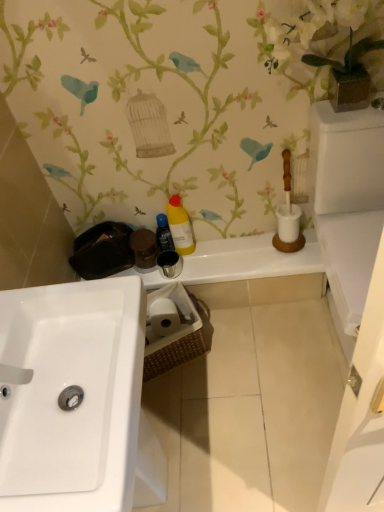
Question: Is yellow matte bottle at center, the second cleaning product positioned from the right, facing towards white glossy sink at lower left?

Choices:
 (A) no
 (B) yes

Answer: (B)

Question: Is yellow matte bottle at center, the second cleaning product positioned from the right, closer to the viewer compared to white glossy sink at lower left?

Choices:
 (A) yes
 (B) no

Answer: (B)

Question: From the image's perspective, is yellow matte bottle at center, the second cleaning product positioned from the right, below white glossy sink at lower left?

Choices:
 (A) no
 (B) yes

Answer: (A)

Question: Is yellow matte bottle at center, the second cleaning product positioned from the right, turned away from white glossy sink at lower left?

Choices:
 (A) yes
 (B) no

Answer: (B)

Question: Is yellow matte bottle at center, arranged as the 1th cleaning product when viewed from the left, taller than white glossy sink at lower left?

Choices:
 (A) yes
 (B) no

Answer: (B)

Question: From the image's perspective, is yellow matte bottle at center, the second cleaning product positioned from the right, over white glossy sink at lower left?

Choices:
 (A) yes
 (B) no

Answer: (A)

Question: Can you confirm if white glossy sink at lower left is thinner than matte black toiletries at center?

Choices:
 (A) no
 (B) yes

Answer: (A)

Question: Can you confirm if white glossy sink at lower left is taller than matte black toiletries at center?

Choices:
 (A) yes
 (B) no

Answer: (A)

Question: Is white glossy sink at lower left facing towards matte black toiletries at center?

Choices:
 (A) no
 (B) yes

Answer: (A)

Question: From a real-world perspective, does white glossy sink at lower left sit lower than matte black toiletries at center?

Choices:
 (A) yes
 (B) no

Answer: (B)

Question: Can you confirm if white glossy sink at lower left is shorter than matte black toiletries at center?

Choices:
 (A) no
 (B) yes

Answer: (A)

Question: Can you see white glossy sink at lower left touching matte black toiletries at center?

Choices:
 (A) no
 (B) yes

Answer: (A)

Question: Is matte black toiletries at center oriented away from white glossy sink at lower left?

Choices:
 (A) no
 (B) yes

Answer: (A)